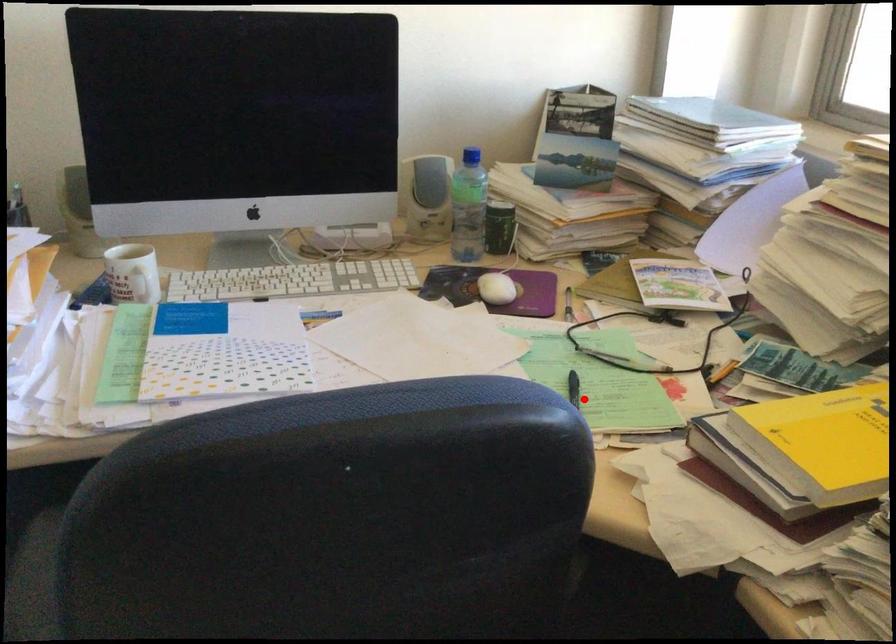
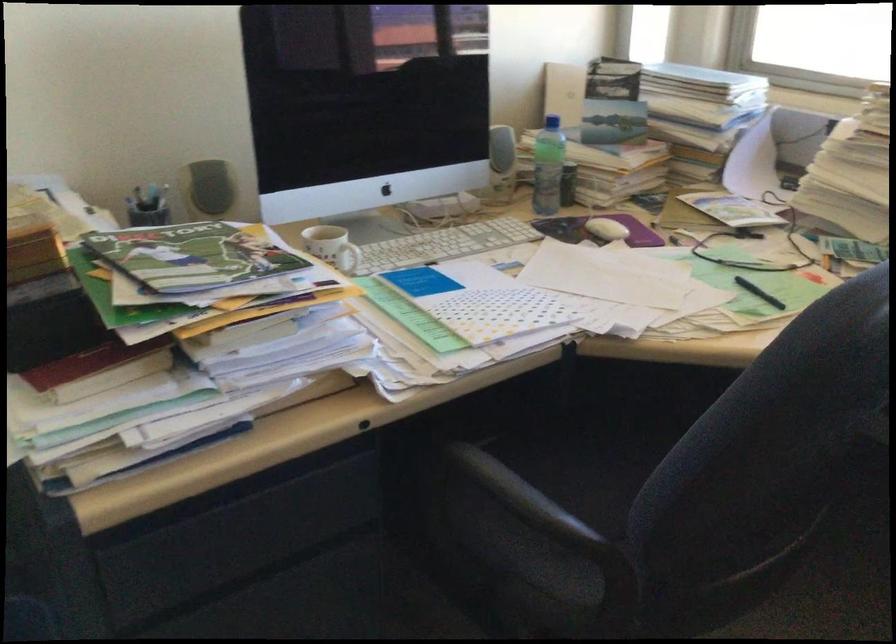
Question: A red point is marked in image1. In image2, is the corresponding 3D point closer to the camera or farther? Reply with the corresponding letter.

Choices:
 (A) The corresponding 3D point is closer.
 (B) The corresponding 3D point is farther.

Answer: (B)